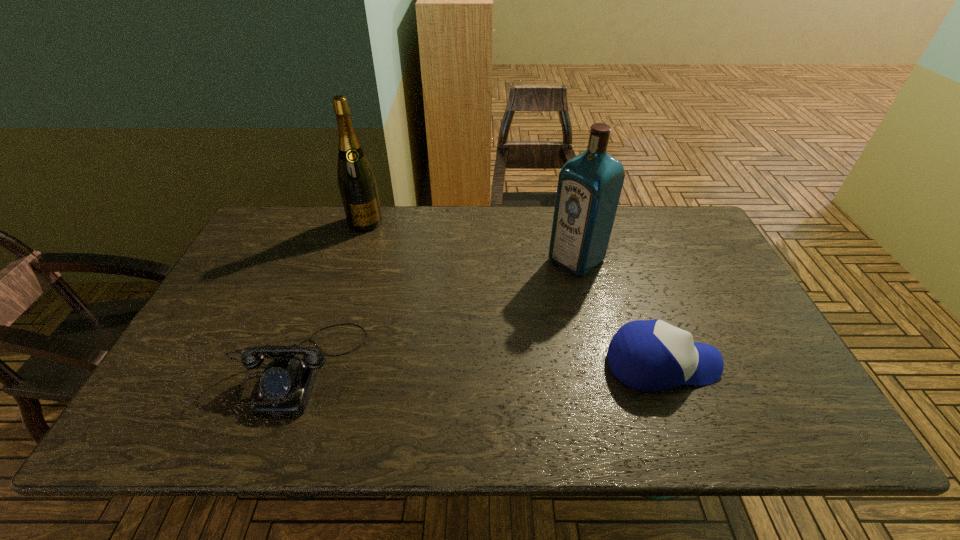
Locate an element on the screen. The width and height of the screenshot is (960, 540). liquor located at the far edge is located at coordinates (589, 186).

Where is `wine bottle present at the far edge`? This screenshot has height=540, width=960. wine bottle present at the far edge is located at coordinates (356, 181).

Locate an element on the screen. This screenshot has height=540, width=960. telephone located at the near edge is located at coordinates (286, 383).

The width and height of the screenshot is (960, 540). In order to click on baseball cap that is at the near edge in this screenshot , I will do click(648, 355).

Locate an element on the screen. object present at the left edge is located at coordinates (286, 383).

Where is `object that is positioned at the right edge`? This screenshot has height=540, width=960. object that is positioned at the right edge is located at coordinates point(648,355).

I want to click on object that is at the near left corner, so click(286, 383).

The width and height of the screenshot is (960, 540). What are the coordinates of `object that is positioned at the near right corner` in the screenshot? It's located at (648, 355).

The height and width of the screenshot is (540, 960). In the image, there is a desktop. Find the location of `vacant space at the far edge`. vacant space at the far edge is located at coordinates pos(633,228).

Locate an element on the screen. The height and width of the screenshot is (540, 960). free point at the near edge is located at coordinates click(343, 395).